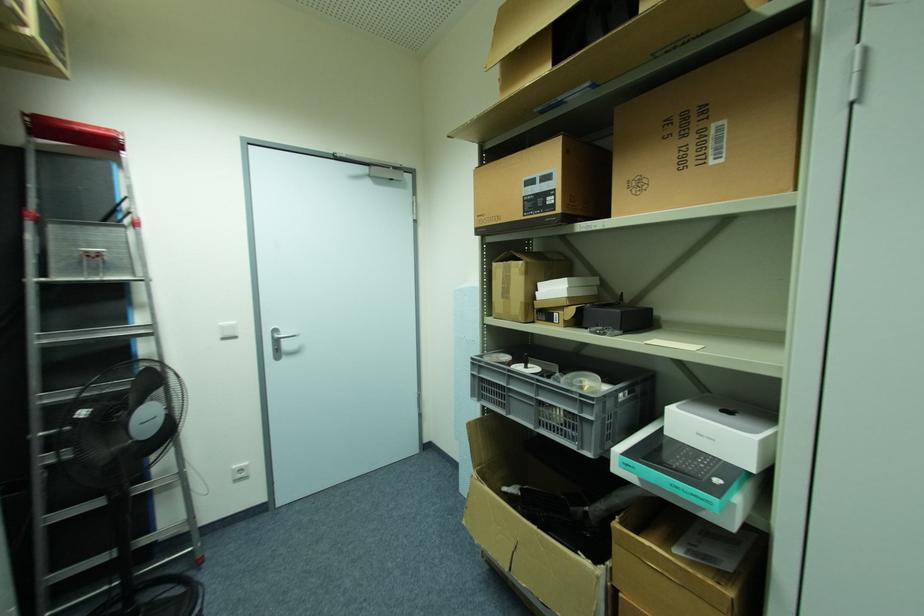
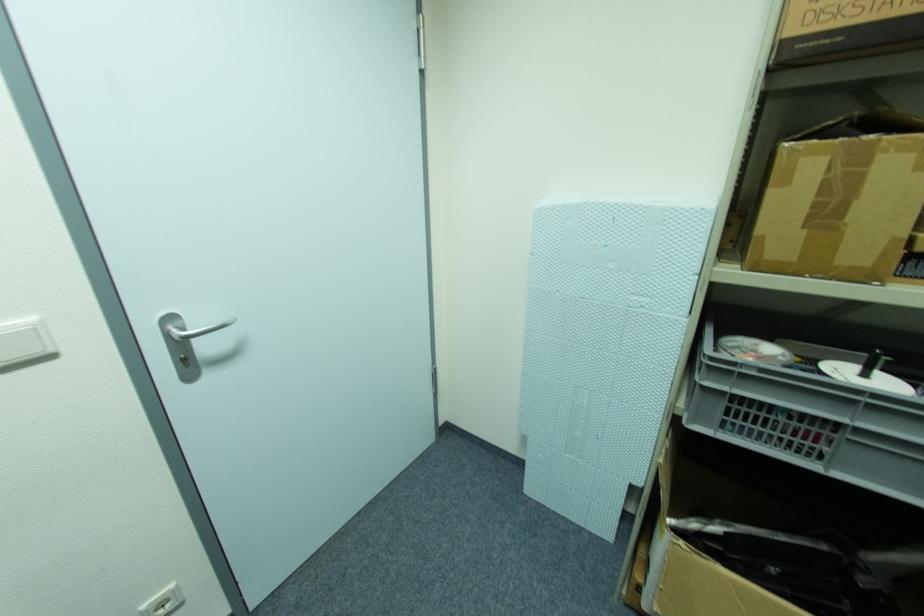
Find the pixel in the second image that matches pixel 235 328 in the first image.

(34, 331)